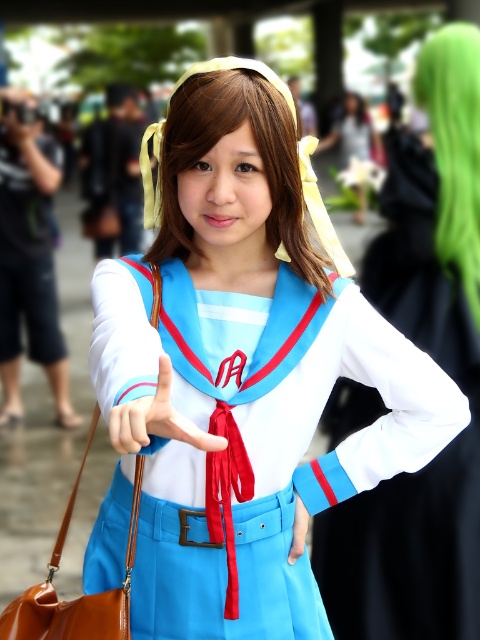
You are a photographer trying to capture the perfect shot of the person in the sailor school uniform. You notice two points marked on the image. The first point is at coordinate point (179, 129) and the second is at point (301, 524). Which point is closer to the camera?

Point (179, 129) is in front of point (301, 524), so it is closer to the camera.

You are standing in front of a person wearing a uniform. Where is the matte blue uniform at center located in relation to the person?

The matte blue uniform at center is located at the person themselves, as the uniform is what they are wearing.

You are a tailor who needs to adjust the proportions of the matte blue uniform at center and the matte blue glove at center. Based on the image, which one is wider?

The matte blue uniform at center is wider than the matte blue glove at center.